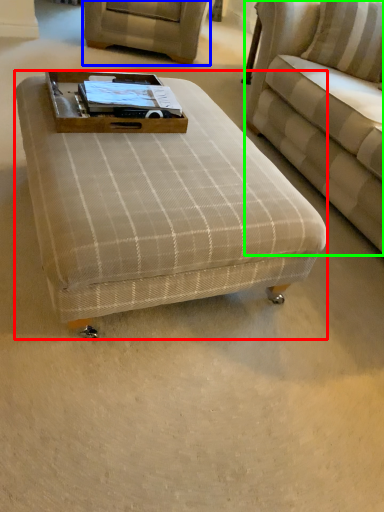
Question: Which is farther away from table (highlighted by a red box)? swivel chair (highlighted by a blue box) or studio couch (highlighted by a green box)?

Choices:
 (A) swivel chair
 (B) studio couch

Answer: (A)